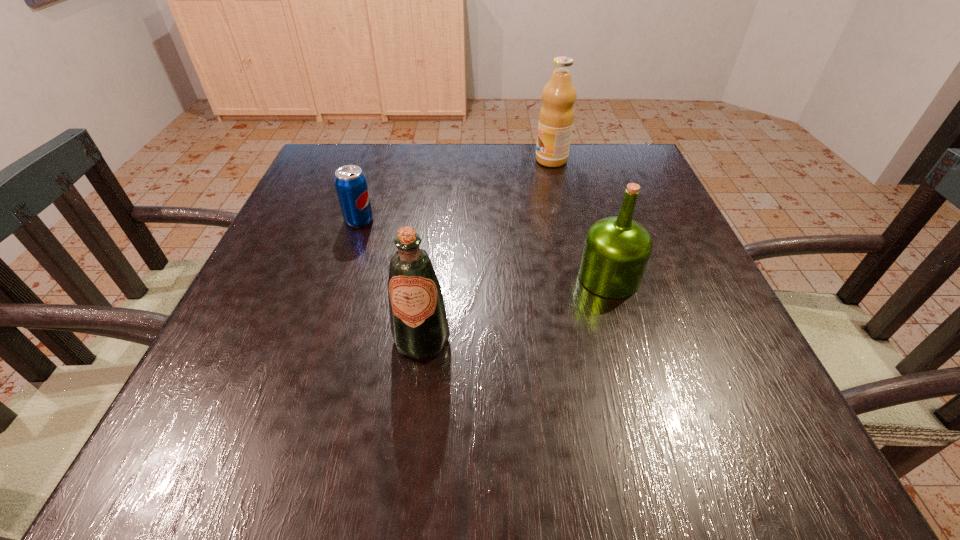
The image size is (960, 540). I want to click on the farthest olive oil, so click(556, 117).

You are a GUI agent. You are given a task and a screenshot of the screen. Output one action in this format:
    pyautogui.click(x=<x>, y=<y>)
    Task: Click on the third object from right to left
    
    Given the screenshot: What is the action you would take?
    (419, 325)

This screenshot has height=540, width=960. I want to click on the leftmost olive oil, so click(419, 325).

Locate an element on the screen. the second farthest olive oil is located at coordinates (616, 251).

I want to click on pop soda, so click(x=350, y=182).

Where is `the leftmost object`? This screenshot has width=960, height=540. the leftmost object is located at coordinates (350, 182).

Find the location of a particular element. vacant area situated on the label of the farthest olive oil is located at coordinates (400, 160).

At what (x,y) coordinates should I click in order to perform the action: click on free location located on the label of the farthest olive oil. Please return your answer as a coordinate pair (x, y). Looking at the image, I should click on (460, 160).

Find the location of `free spot located 0.250m on the label of the farthest olive oil`. free spot located 0.250m on the label of the farthest olive oil is located at coordinates (442, 160).

Image resolution: width=960 pixels, height=540 pixels. Find the location of `vacant space located on the front-facing side of the leftmost olive oil`. vacant space located on the front-facing side of the leftmost olive oil is located at coordinates (416, 390).